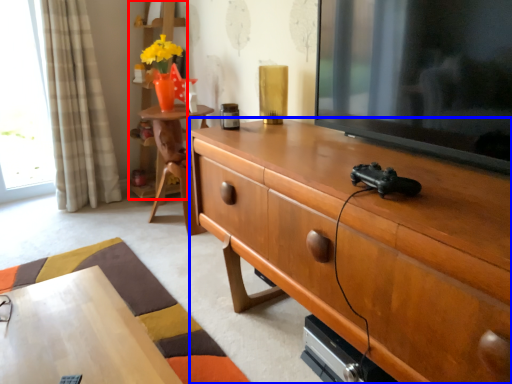
Question: Which object appears farthest to the camera in this image, bookshelf (highlighted by a red box) or cabinetry (highlighted by a blue box)?

Choices:
 (A) bookshelf
 (B) cabinetry

Answer: (A)